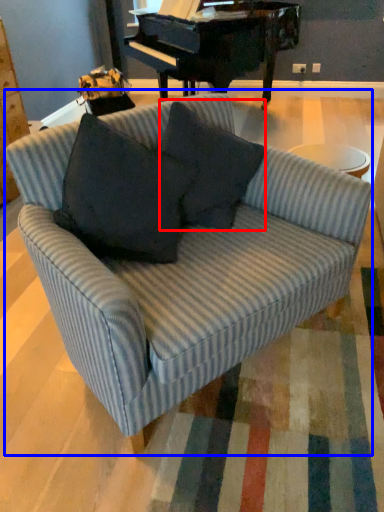
Question: Which object appears farthest to the camera in this image, throw pillow (highlighted by a red box) or studio couch (highlighted by a blue box)?

Choices:
 (A) throw pillow
 (B) studio couch

Answer: (A)